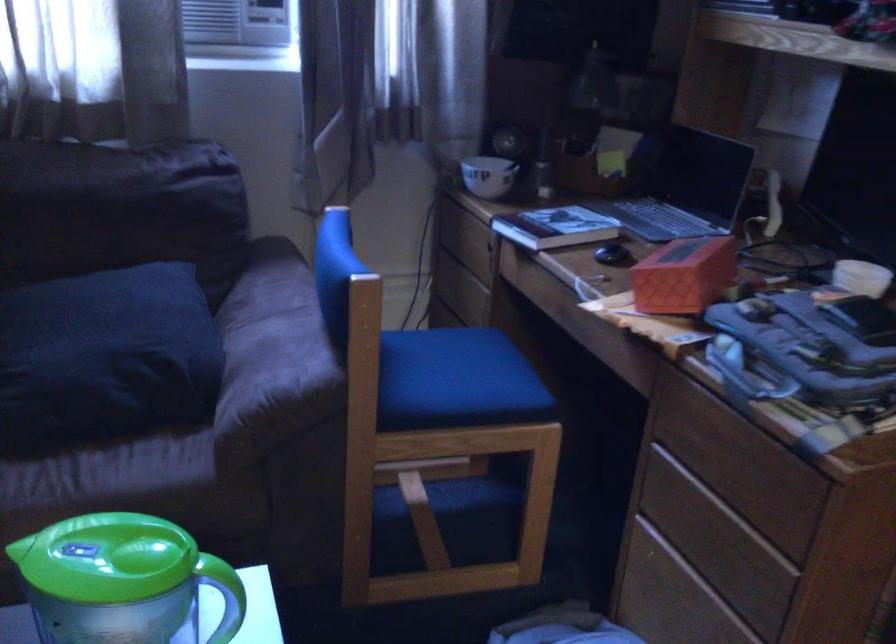
Find where to grasp the green pitcher handle. Please return your answer as a coordinate pair (x, y).

(222, 594)